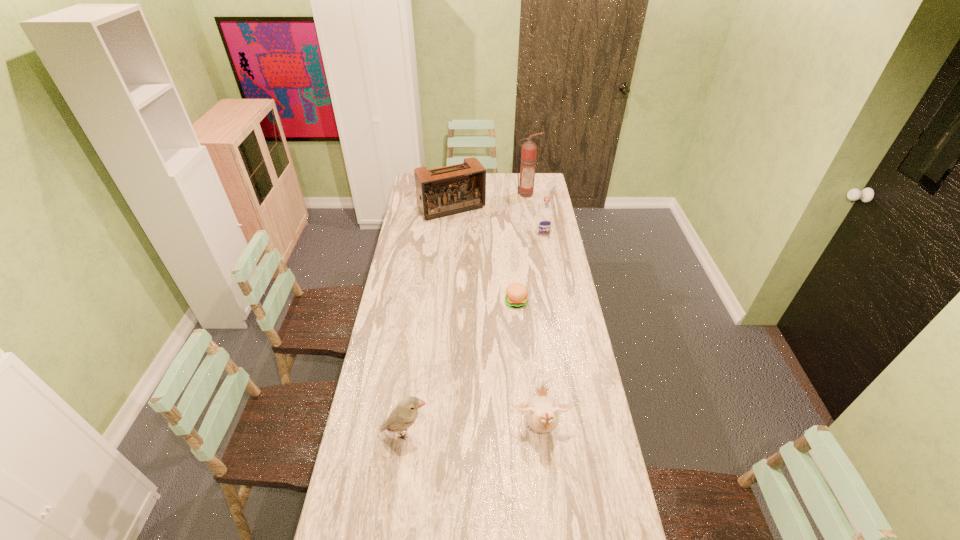
At what (x,y) coordinates should I click in order to perform the action: click on free area in between the right bird and the hamburger. Please return your answer as a coordinate pair (x, y). This screenshot has width=960, height=540. Looking at the image, I should click on (528, 365).

The height and width of the screenshot is (540, 960). In order to click on vacant area that lies between the second tallest object and the tallest object in this screenshot , I will do `click(489, 201)`.

This screenshot has width=960, height=540. Identify the location of object that stands as the fourth closest to the fourth farthest object. tap(404, 415).

Select which object appears as the closest to the fire extinguisher. Please provide its 2D coordinates. Your answer should be formatted as a tuple, i.e. [(x, y)], where the tuple contains the x and y coordinates of a point satisfying the conditions above.

[(440, 192)]

Locate an element on the screen. free space that satisfies the following two spatial constraints: 1. on the front side of the hamburger; 2. at the face of the left bird is located at coordinates (527, 433).

Image resolution: width=960 pixels, height=540 pixels. I want to click on vacant region that satisfies the following two spatial constraints: 1. on the label of the fourth nearest object; 2. at the face of the left bird, so (x=579, y=433).

Where is `vacant space that satisfies the following two spatial constraints: 1. on the side of the fire extinguisher with the label and nozzle; 2. at the face of the left bird`? Image resolution: width=960 pixels, height=540 pixels. vacant space that satisfies the following two spatial constraints: 1. on the side of the fire extinguisher with the label and nozzle; 2. at the face of the left bird is located at coordinates (561, 433).

You are a GUI agent. You are given a task and a screenshot of the screen. Output one action in this format:
    pyautogui.click(x=<x>, y=<y>)
    Task: Click on the vacant area that satisfies the following two spatial constraints: 1. on the side of the tallest object with the label and nozzle; 2. at the face of the left bird
    This screenshot has height=540, width=960.
    Given the screenshot: What is the action you would take?
    pyautogui.click(x=561, y=433)

The width and height of the screenshot is (960, 540). I want to click on free location that satisfies the following two spatial constraints: 1. on the side of the fire extinguisher with the label and nozzle; 2. at the face of the left bird, so click(561, 433).